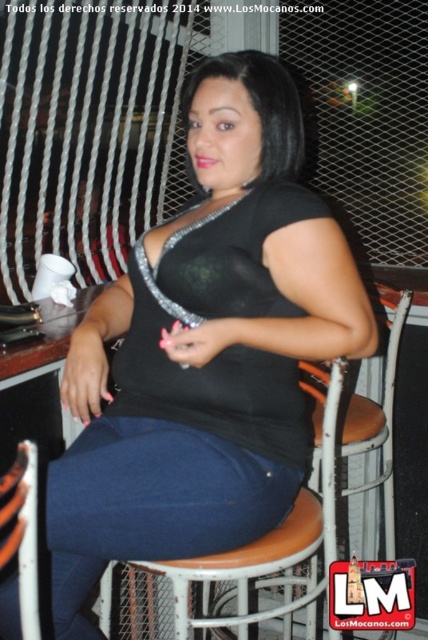
Question: Is black matte dress at center below brown leather chair at lower left?

Choices:
 (A) no
 (B) yes

Answer: (A)

Question: Does black matte dress at center have a smaller size compared to orange cushioned stool at center?

Choices:
 (A) no
 (B) yes

Answer: (A)

Question: Does black matte dress at center come in front of orange cushioned stool at center?

Choices:
 (A) yes
 (B) no

Answer: (A)

Question: Which object appears farthest from the camera in this image?

Choices:
 (A) black matte dress at center
 (B) brown leather chair at lower left
 (C) orange cushioned stool at center

Answer: (C)

Question: Which point is closer to the camera?

Choices:
 (A) (32, 573)
 (B) (110, 602)
 (C) (228, 381)

Answer: (A)

Question: Which point is closer to the camera taking this photo?

Choices:
 (A) (261, 200)
 (B) (285, 541)

Answer: (B)